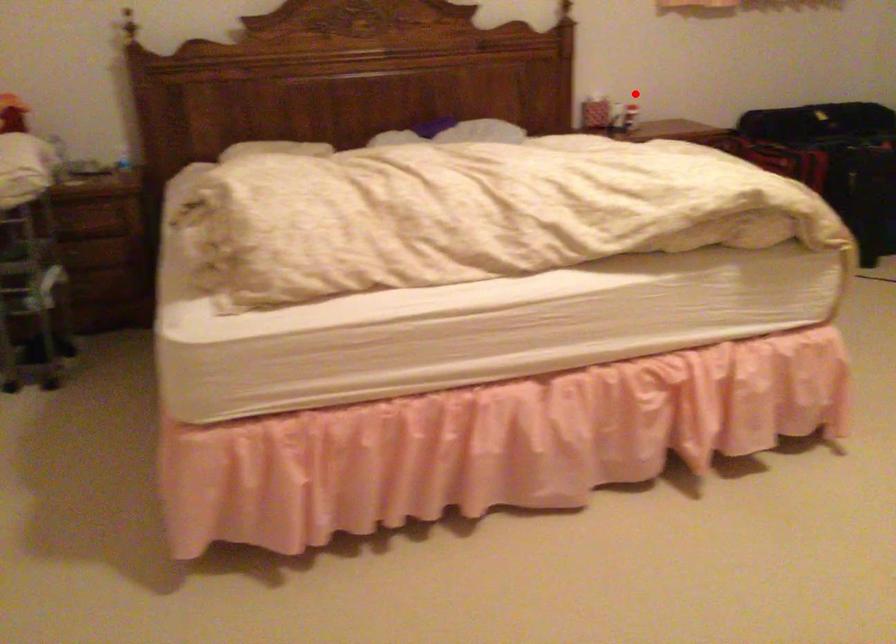
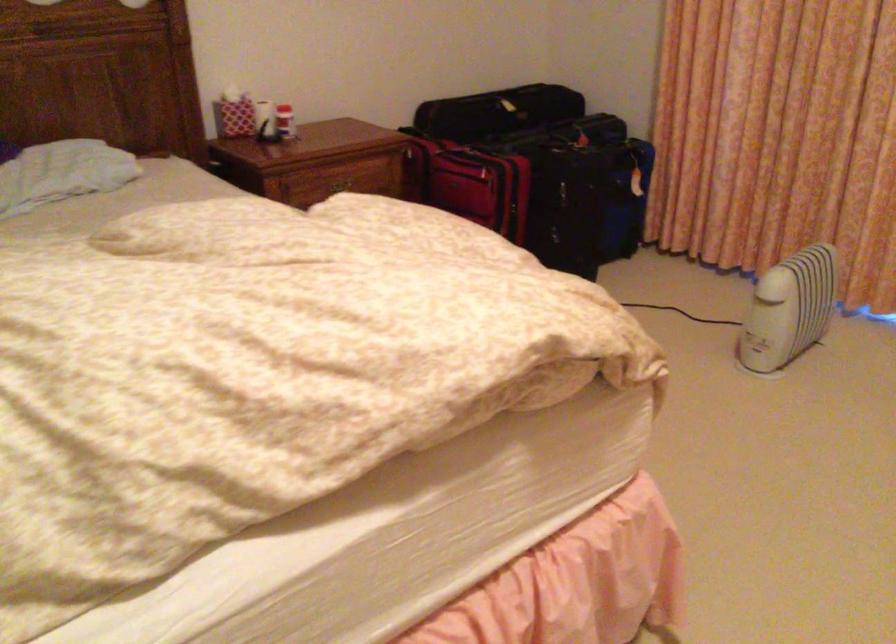
Question: I am providing you with two images of the same scene from different viewpoints. Given a red point in image1, look at the same physical point in image2. Is it:

Choices:
 (A) Closer to the viewpoint
 (B) Farther from the viewpoint

Answer: (A)